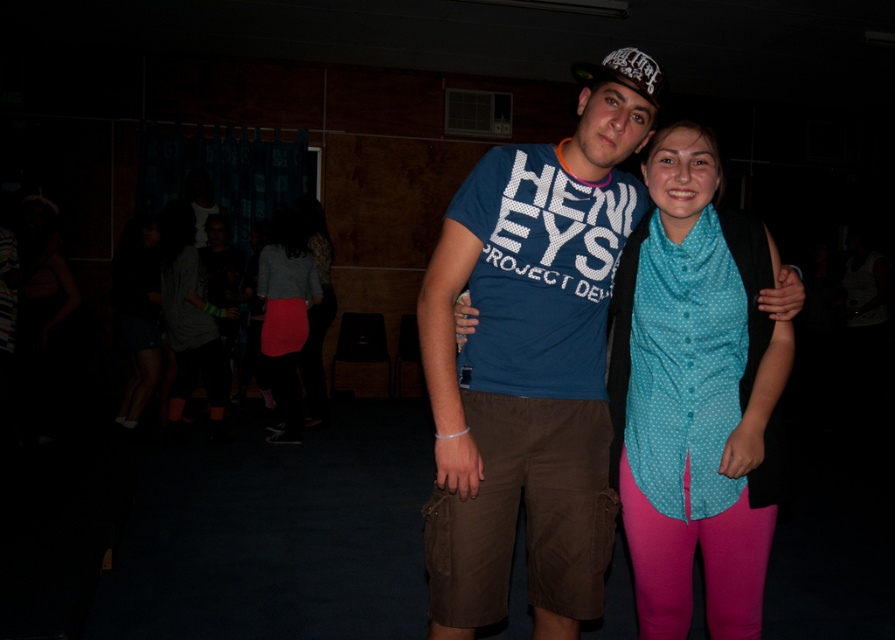
You are a photographer adjusting your camera settings to focus on the matte pink skirt at lower left. Based on its position coordinates, can you determine if it will be in the center of the frame?

The matte pink skirt at lower left is located at point (181, 314), which means it is near the center horizontally but lower vertically, so it will not be exactly centered but close to the lower half of the frame.